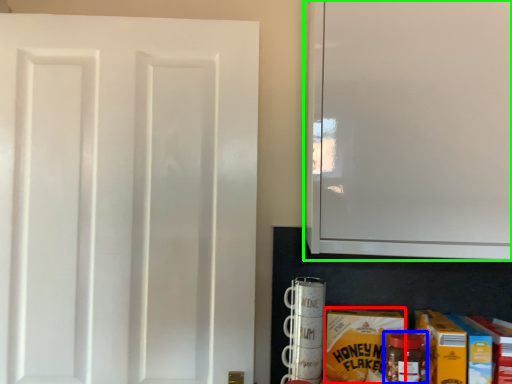
Question: Based on their relative distances, which object is farther from carton (highlighted by a red box)? Choose from bottle (highlighted by a blue box) and cabinetry (highlighted by a green box).

Choices:
 (A) bottle
 (B) cabinetry

Answer: (B)